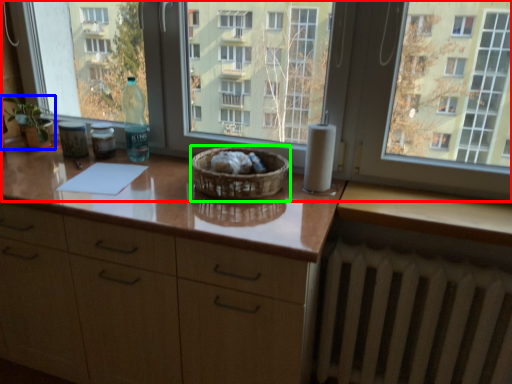
Question: Which object is positioned farthest from window (highlighted by a red box)? Select from houseplant (highlighted by a blue box) and basket (highlighted by a green box).

Choices:
 (A) houseplant
 (B) basket

Answer: (A)